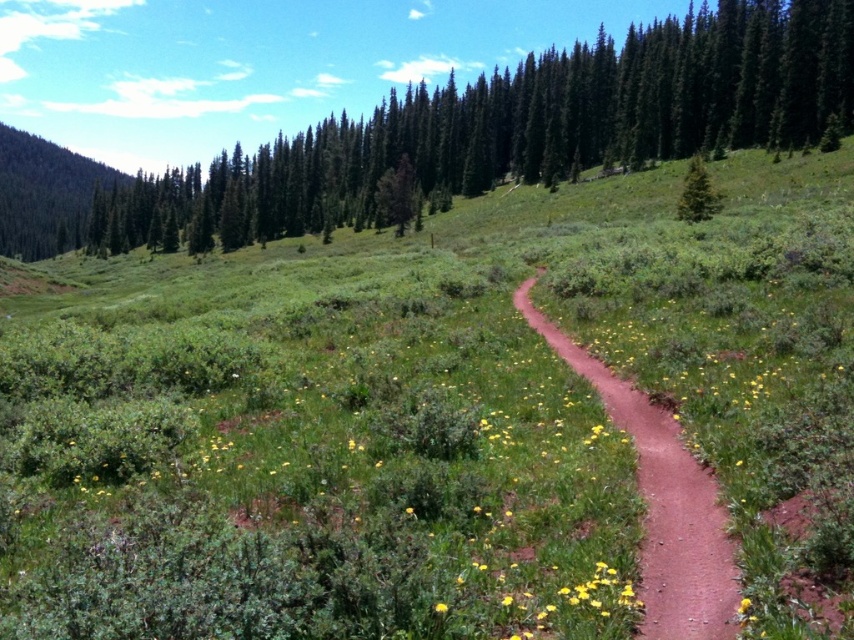
The height and width of the screenshot is (640, 854). What do you see at coordinates (522, 125) in the screenshot?
I see `green textured tree at upper center` at bounding box center [522, 125].

Does point (814, 83) lie in front of point (706, 188)?

That is False.

Find the location of a particular element. The image size is (854, 640). green textured tree at upper center is located at coordinates (522, 125).

Is green textured tree at upper center wider than red dirt path at center?

Yes, green textured tree at upper center is wider than red dirt path at center.

Between point (826, 109) and point (677, 538), which one is positioned behind?

Positioned behind is point (826, 109).

Between point (699, 100) and point (705, 509), which one is positioned in front?

Point (705, 509) is in front.

At what (x,y) coordinates should I click in order to perform the action: click on green textured tree at upper center. Please return your answer as a coordinate pair (x, y). Looking at the image, I should click on (522, 125).

Who is shorter, red dirt path at center or yellow matte flower at center?

yellow matte flower at center is shorter.

Locate an element on the screen. red dirt path at center is located at coordinates (662, 502).

Image resolution: width=854 pixels, height=640 pixels. Identify the location of red dirt path at center. (662, 502).